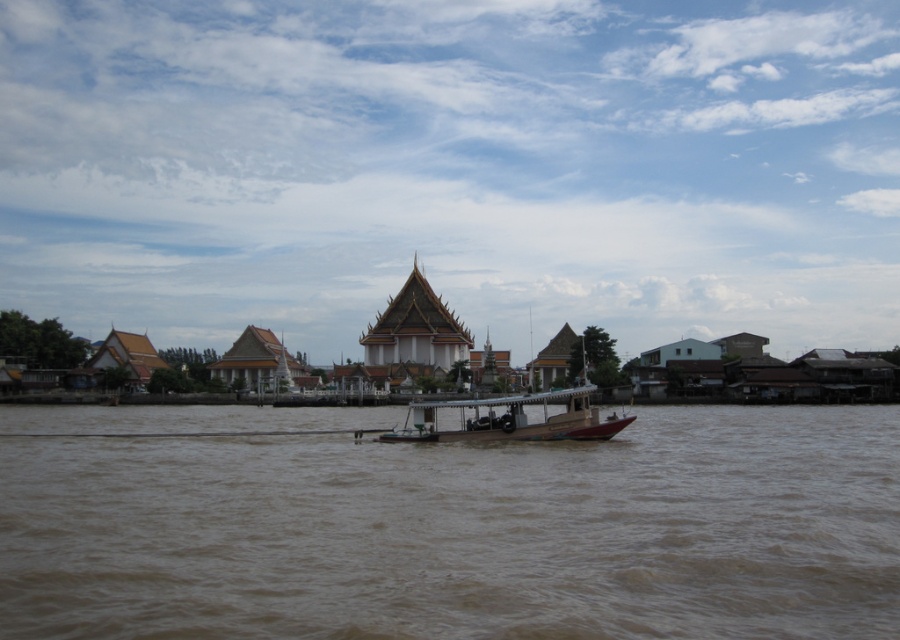
Is the position of wooden boat at center more distant than that of golden textured temple at center?

That is False.

Image resolution: width=900 pixels, height=640 pixels. I want to click on wooden boat at center, so click(511, 419).

Is point (436, 438) behind point (392, 339)?

No, (436, 438) is closer to viewer.

You are a GUI agent. You are given a task and a screenshot of the screen. Output one action in this format:
    pyautogui.click(x=<x>, y=<y>)
    Task: Click on the wooden boat at center
    
    Given the screenshot: What is the action you would take?
    pyautogui.click(x=511, y=419)

Is point (482, 620) behind point (472, 426)?

That is False.

Between brown muddy water at center and wooden boat at center, which one is positioned higher?

wooden boat at center

Does point (742, 435) come in front of point (540, 394)?

No, it is not.

At what (x,y) coordinates should I click in order to perform the action: click on brown muddy water at center. Please return your answer as a coordinate pair (x, y). Looking at the image, I should click on (464, 532).

You are a GUI agent. You are given a task and a screenshot of the screen. Output one action in this format:
    pyautogui.click(x=<x>, y=<y>)
    Task: Click on the brown muddy water at center
    This screenshot has width=900, height=640.
    Given the screenshot: What is the action you would take?
    pyautogui.click(x=464, y=532)

What are the coordinates of `brown muddy water at center` in the screenshot? It's located at (464, 532).